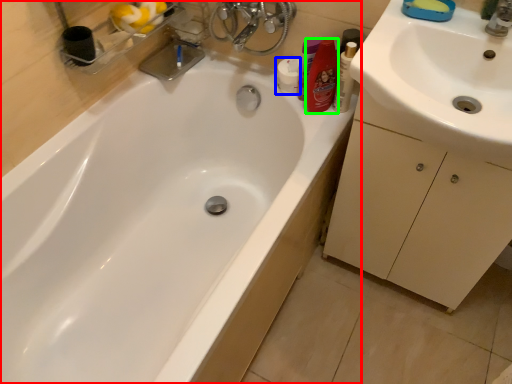
Question: Which is nearer to the bathtub (highlighted by a red box)? toiletry (highlighted by a blue box) or toiletry (highlighted by a green box).

Choices:
 (A) toiletry
 (B) toiletry

Answer: (B)